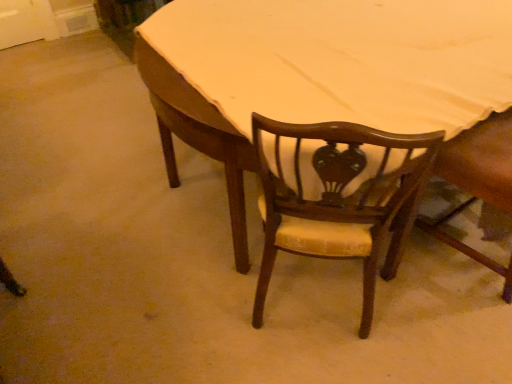
Where is `vacant space situated on the left part of wooden chair at center, which is the second chair from right to left`? This screenshot has height=384, width=512. vacant space situated on the left part of wooden chair at center, which is the second chair from right to left is located at coordinates (202, 300).